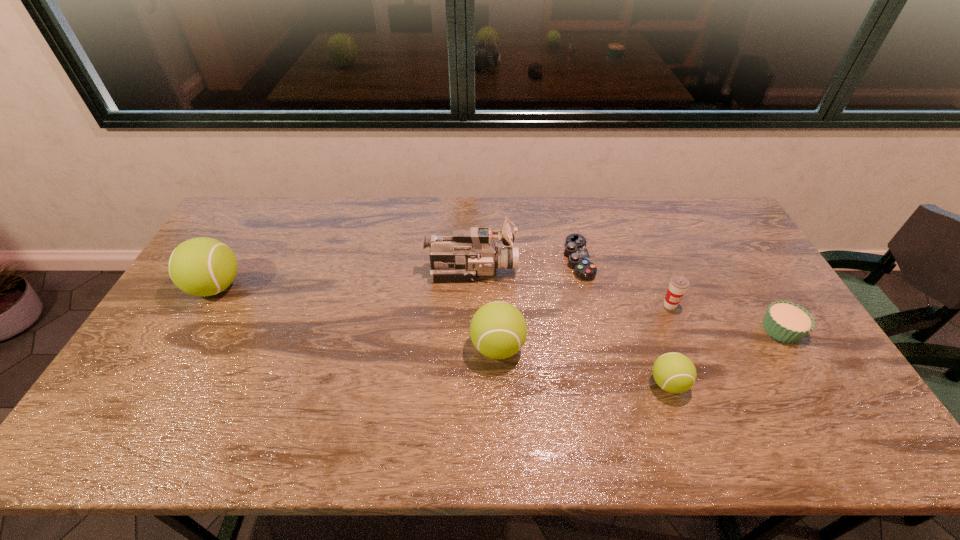
At what (x,y) coordinates should I click in order to perform the action: click on vacant area that lies between the camcorder and the fifth tallest object. Please return your answer as a coordinate pair (x, y). The image size is (960, 540). Looking at the image, I should click on (570, 327).

Locate an element on the screen. free area in between the second shortest object and the second shortest tennis ball is located at coordinates (639, 338).

Identify the location of empty space between the camcorder and the shortest tennis ball. (570, 327).

The width and height of the screenshot is (960, 540). In order to click on vacant space that is in between the rightmost object and the camcorder in this screenshot , I will do `click(627, 300)`.

Identify which object is located as the sixth nearest to the fifth object from left to right. Please provide its 2D coordinates. Your answer should be formatted as a tuple, i.e. [(x, y)], where the tuple contains the x and y coordinates of a point satisfying the conditions above.

[(202, 266)]

Locate an element on the screen. Image resolution: width=960 pixels, height=540 pixels. object that is the second closest to the camcorder is located at coordinates (498, 330).

Select which tennis ball appears as the closest to the shortest tennis ball. Please provide its 2D coordinates. Your answer should be formatted as a tuple, i.e. [(x, y)], where the tuple contains the x and y coordinates of a point satisfying the conditions above.

[(498, 330)]

Locate which tennis ball is the second closest to the camcorder. Please provide its 2D coordinates. Your answer should be formatted as a tuple, i.e. [(x, y)], where the tuple contains the x and y coordinates of a point satisfying the conditions above.

[(674, 372)]

At what (x,y) coordinates should I click in order to perform the action: click on free location that satisfies the following two spatial constraints: 1. on the front-facing side of the second tennis ball from left to right; 2. on the left side of the camcorder. Please return your answer as a coordinate pair (x, y). Looking at the image, I should click on (470, 347).

Where is `vacant region that satisfies the following two spatial constraints: 1. on the side of the rightmost object with the logo; 2. on the left side of the cup`? This screenshot has height=540, width=960. vacant region that satisfies the following two spatial constraints: 1. on the side of the rightmost object with the logo; 2. on the left side of the cup is located at coordinates (680, 329).